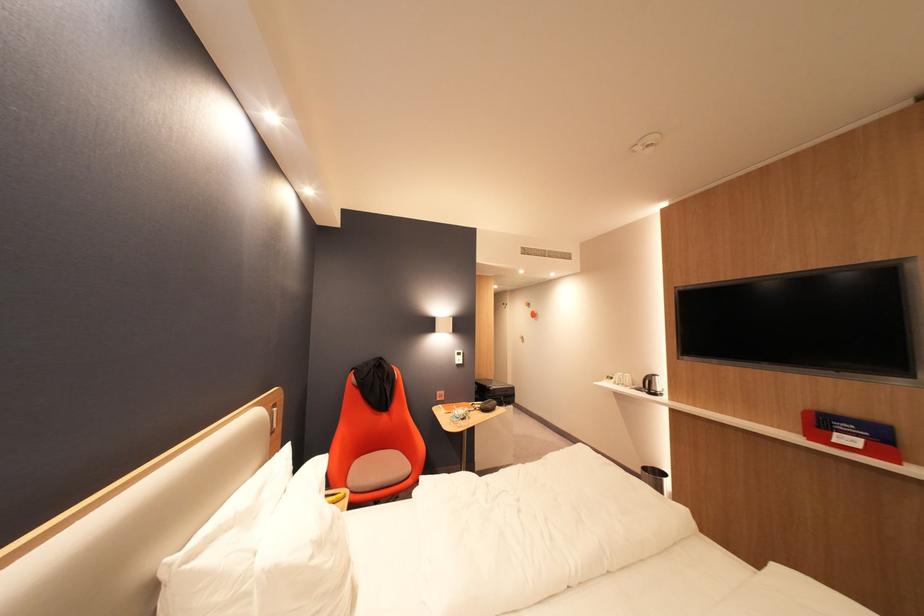
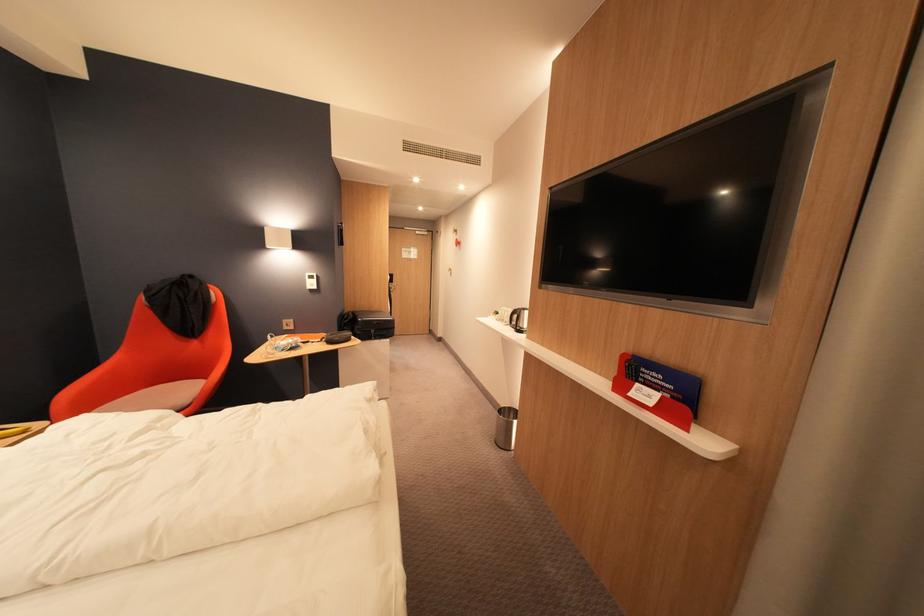
Find the pixel in the second image that matches the point at 502,390 in the first image.

(370, 321)